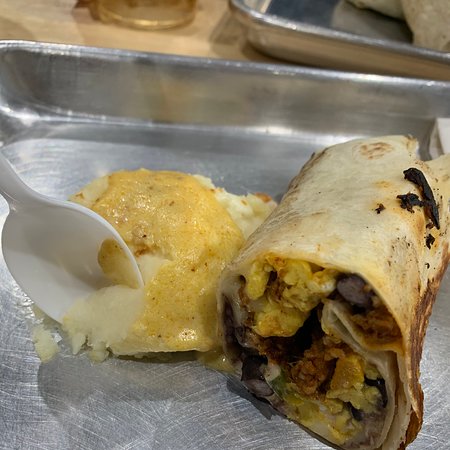
Locate an element on the screen. This screenshot has width=450, height=450. table is located at coordinates (x=135, y=40).